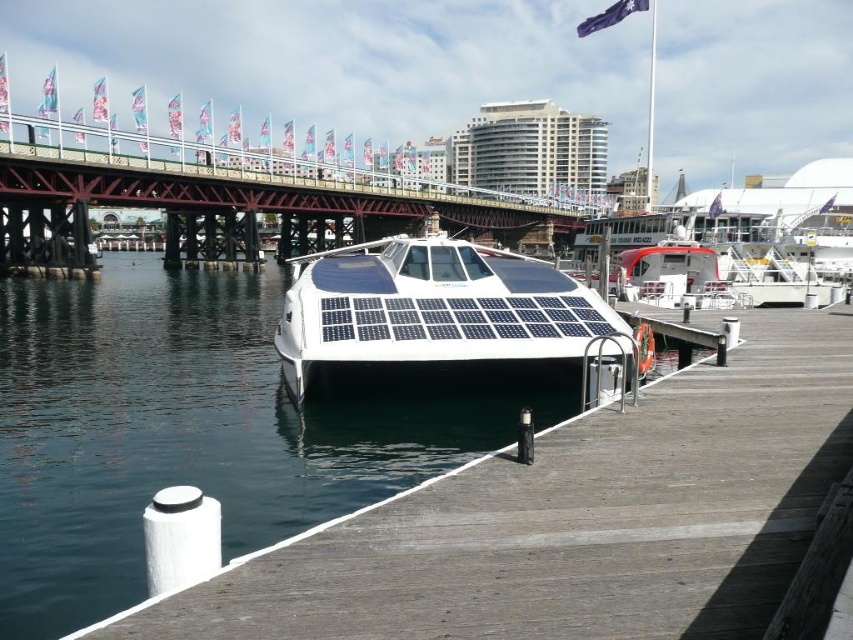
You are standing on the wooden pier and see two points marked on the water surface. The first point is at coordinate point(91, 474) and the second point is at point(527, 289). From your perspective on the pier, which point is closer to you?

Point(91, 474) is in front of point(527, 289), so it is closer to you.

You are a tourist planning to take a photo of the metallic bridge at upper center and the transparent glass water at center from the wooden pier. Which object should you stand closer to in order to capture both in a single frame?

You should stand closer to the transparent glass water at center because it is positioned to the left of the metallic bridge at upper center, so moving closer to it will help include both in your photo frame.

You are an engineer inspecting the waterfront scene. You need to determine which object, the transparent glass water at center or the metallic bridge at upper center, has a lower height. Based on the scene, which one is shorter?

Result: The transparent glass water at center is shorter than the metallic bridge at upper center.